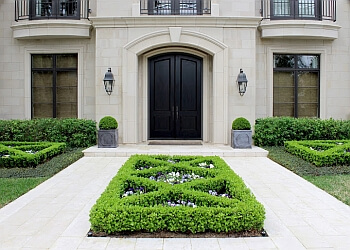
Where is `lamp to the left of the door`? The height and width of the screenshot is (250, 350). lamp to the left of the door is located at coordinates (106, 80).